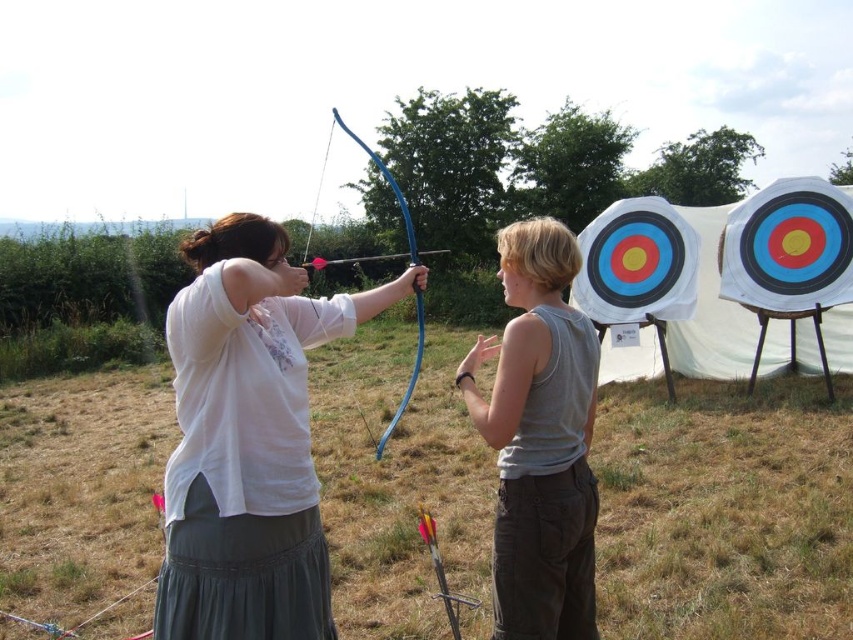
Question: Which point is farther from the camera taking this photo?

Choices:
 (A) (202, 444)
 (B) (384, 429)
 (C) (509, 401)

Answer: (B)

Question: Which point is closer to the camera taking this photo?

Choices:
 (A) (456, 600)
 (B) (305, 372)
 (C) (589, 584)
 (D) (334, 262)

Answer: (B)

Question: Which of these objects is positioned farthest from the blue wood bow at center?

Choices:
 (A) gray cotton tank top at center
 (B) yellow arrow at center
 (C) white matte shirt at center

Answer: (A)

Question: Can you confirm if white matte shirt at center is positioned to the left of yellow arrow at center?

Choices:
 (A) no
 (B) yes

Answer: (B)

Question: From the image, what is the correct spatial relationship of blue wood bow at center in relation to yellow arrow at center?

Choices:
 (A) above
 (B) below

Answer: (A)

Question: Is white matte shirt at center in front of blue wood bow at center?

Choices:
 (A) no
 (B) yes

Answer: (B)